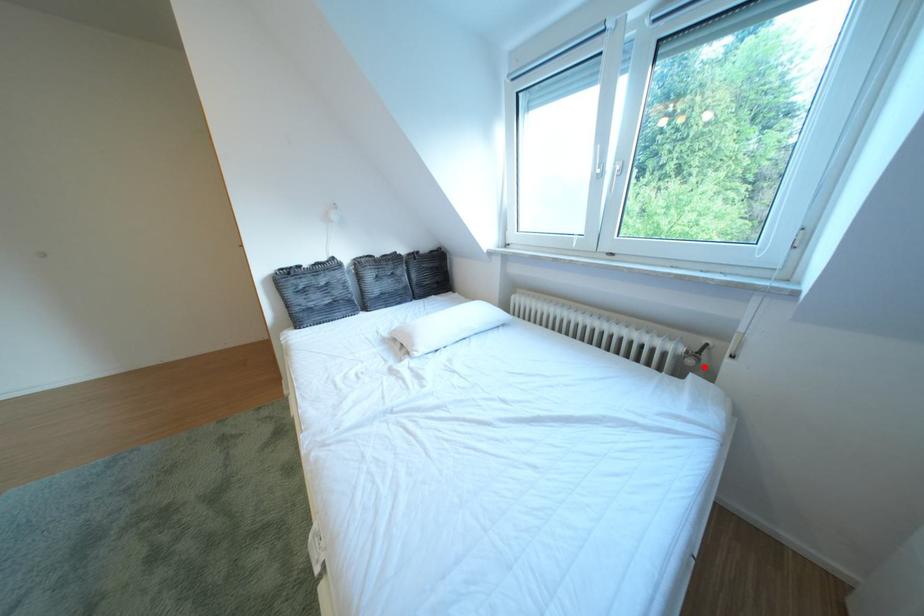
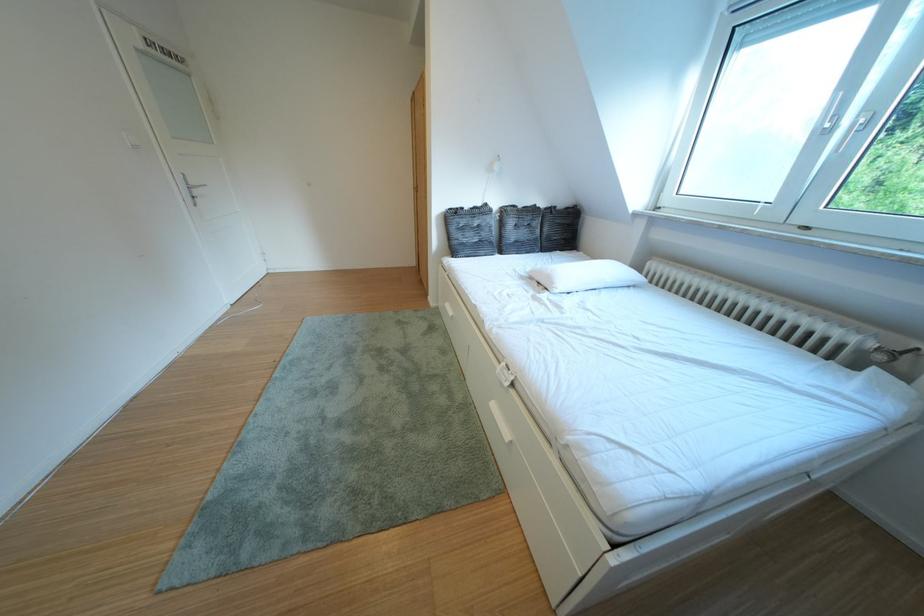
Question: A red point is marked in image1. In image2, is the corresponding 3D point closer to the camera or farther? Reply with the corresponding letter.

Choices:
 (A) The corresponding 3D point is closer.
 (B) The corresponding 3D point is farther.

Answer: (B)